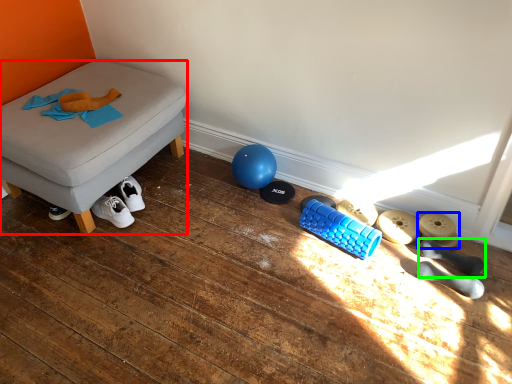
Question: Which object is the farthest from furniture (highlighted by a red box)? Choose among these: footwear (highlighted by a blue box) or footwear (highlighted by a green box).

Choices:
 (A) footwear
 (B) footwear

Answer: (B)